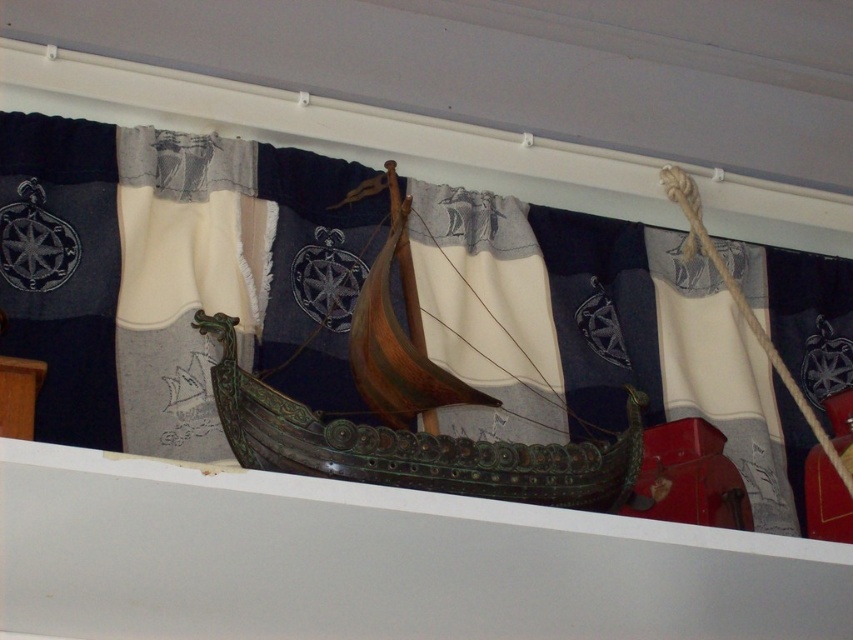
Question: Is dark blue fabric with nautical symbols at center wider than white textured fabric at left?

Choices:
 (A) no
 (B) yes

Answer: (B)

Question: Is dark blue fabric with nautical symbols at center in front of wooden ship at center?

Choices:
 (A) no
 (B) yes

Answer: (A)

Question: Considering the relative positions of wooden ship at center and white textured fabric at left in the image provided, where is wooden ship at center located with respect to white textured fabric at left?

Choices:
 (A) right
 (B) left

Answer: (A)

Question: Considering the real-world distances, which object is farthest from the wooden ship at center?

Choices:
 (A) white textured fabric at left
 (B) dark blue fabric with nautical symbols at center

Answer: (B)

Question: Considering the real-world distances, which object is farthest from the wooden ship at center?

Choices:
 (A) dark blue fabric with nautical symbols at center
 (B) white textured fabric at left

Answer: (A)

Question: Which object is closer to the camera taking this photo?

Choices:
 (A) white textured fabric at left
 (B) dark blue fabric with nautical symbols at center
 (C) wooden ship at center

Answer: (C)